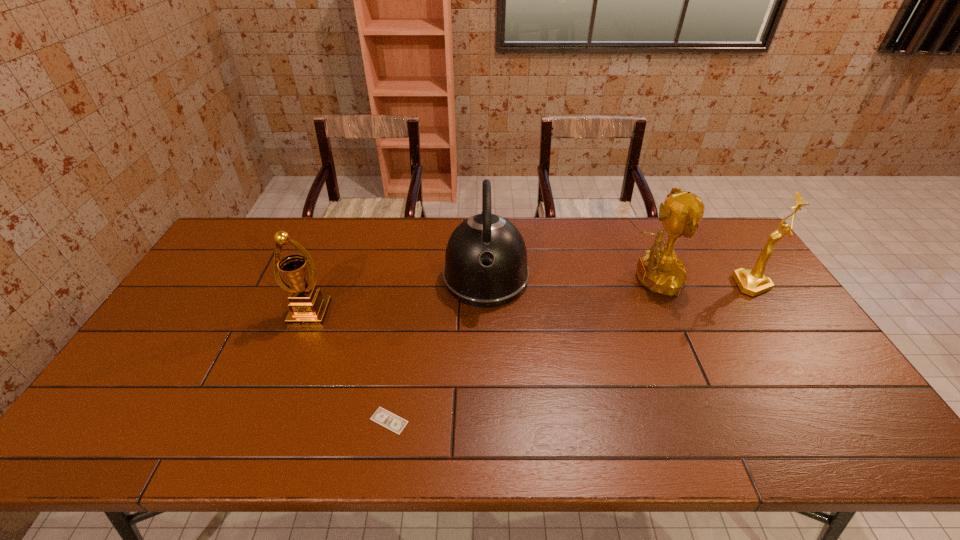
At what (x,y) coordinates should I click in order to perform the action: click on free location that satisfies the following two spatial constraints: 1. on the front side of the second object from right to left; 2. on the front-facing side of the leftmost award. Please return your answer as a coordinate pair (x, y). The width and height of the screenshot is (960, 540). Looking at the image, I should click on (664, 313).

You are a GUI agent. You are given a task and a screenshot of the screen. Output one action in this format:
    pyautogui.click(x=<x>, y=<y>)
    Task: Click on the vacant area in the image that satisfies the following two spatial constraints: 1. on the front-facing side of the leftmost object; 2. on the left side of the shortest object
    
    Given the screenshot: What is the action you would take?
    pyautogui.click(x=268, y=421)